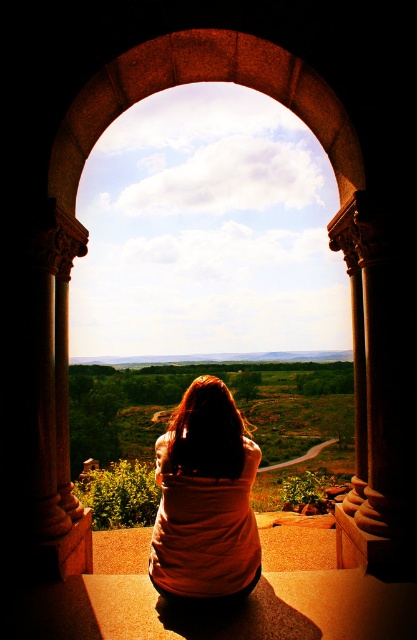
Is matte orange shirt at center thinner than stone archway at center?

Yes.

Can you confirm if matte orange shirt at center is positioned to the left of stone archway at center?

In fact, matte orange shirt at center is to the right of stone archway at center.

Is point (170, 486) more distant than point (98, 122)?

No, it is in front of (98, 122).

Where is `matte orange shirt at center`? matte orange shirt at center is located at coordinates [205, 500].